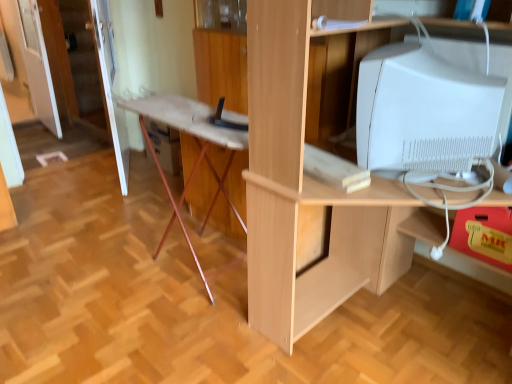
The image size is (512, 384). What do you see at coordinates (311, 186) in the screenshot?
I see `light wood desk at center` at bounding box center [311, 186].

Describe the element at coordinates (83, 72) in the screenshot. The height and width of the screenshot is (384, 512). I see `white glossy door at upper left, the 1th door positioned from the left` at that location.

The height and width of the screenshot is (384, 512). What do you see at coordinates (424, 111) in the screenshot?
I see `white glossy computer monitor at upper right` at bounding box center [424, 111].

You are a GUI agent. You are given a task and a screenshot of the screen. Output one action in this format:
    pyautogui.click(x=<x>, y=<y>)
    Task: Click on the wooden ironing board at center
    
    Given the screenshot: What is the action you would take?
    pyautogui.click(x=197, y=143)

Does point (508, 230) lie behind point (284, 20)?

Yes, point (508, 230) is behind point (284, 20).

Considering the relative sizes of yellow matte drawer at lower right and light wood desk at center in the image provided, is yellow matte drawer at lower right thinner than light wood desk at center?

Indeed, yellow matte drawer at lower right has a lesser width compared to light wood desk at center.

Looking at this image, from a real-world perspective, between yellow matte drawer at lower right and light wood desk at center, who is vertically higher?

From a 3D spatial view, light wood desk at center is above.

Could you tell me if yellow matte drawer at lower right is facing light wood desk at center?

Yes, yellow matte drawer at lower right is turned towards light wood desk at center.

Does white glossy door at upper left, the 1th door positioned from the left, have a smaller size compared to yellow matte drawer at lower right?

No.

Which object is positioned more to the right, white glossy door at upper left, the 1th door positioned from the left, or yellow matte drawer at lower right?

Positioned to the right is yellow matte drawer at lower right.

Is white glossy door at upper left, the 1th door positioned from the left, beside yellow matte drawer at lower right?

No, white glossy door at upper left, the 1th door positioned from the left, is not touching yellow matte drawer at lower right.

From the image's perspective, which is above, white glossy door at upper left, marked as the 2th door in a right-to-left arrangement, or yellow matte drawer at lower right?

white glossy door at upper left, marked as the 2th door in a right-to-left arrangement.

Is wooden ironing board at center to the right of light wood desk at center from the viewer's perspective?

No, wooden ironing board at center is not to the right of light wood desk at center.

Choose the correct answer: Is wooden ironing board at center inside light wood desk at center or outside it?

The correct answer is: outside.

Between wooden ironing board at center and light wood desk at center, which one has less height?

Standing shorter between the two is wooden ironing board at center.

Can you confirm if white glossy door at upper left, which is counted as the first door, starting from the right, is bigger than white glossy computer monitor at upper right?

Correct, white glossy door at upper left, which is counted as the first door, starting from the right, is larger in size than white glossy computer monitor at upper right.

Locate an element on the screen. This screenshot has height=384, width=512. computer monitor below the white glossy door at upper left, which is counted as the first door, starting from the right (from the image's perspective) is located at coordinates (424, 111).

Can white glossy computer monitor at upper right be found inside white glossy door at upper left, the 2th door positioned from the left?

No, white glossy computer monitor at upper right is not a part of white glossy door at upper left, the 2th door positioned from the left.

From a real-world perspective, who is located lower, white glossy door at upper left, the 2th door positioned from the left, or white glossy computer monitor at upper right?

From a 3D spatial view, white glossy door at upper left, the 2th door positioned from the left, is below.

In the image, is transparent glass door at upper left on the left side or the right side of white glossy door at upper left, the 1th door positioned from the left?

From the image, it's evident that transparent glass door at upper left is to the left of white glossy door at upper left, the 1th door positioned from the left.

Considering the relative sizes of transparent glass door at upper left and white glossy door at upper left, marked as the 2th door in a right-to-left arrangement, in the image provided, is transparent glass door at upper left shorter than white glossy door at upper left, marked as the 2th door in a right-to-left arrangement,?

No.

From the image's perspective, which object appears higher, transparent glass door at upper left or white glossy door at upper left, the 1th door positioned from the left?

transparent glass door at upper left.

Is transparent glass door at upper left oriented towards white glossy door at upper left, marked as the 2th door in a right-to-left arrangement?

No, transparent glass door at upper left is not turned towards white glossy door at upper left, marked as the 2th door in a right-to-left arrangement.

Can you confirm if white glossy door at upper left, marked as the 2th door in a right-to-left arrangement, is smaller than light wood desk at center?

Yes.

Is point (103, 13) closer or farther from the camera than point (418, 216)?

Clearly, point (103, 13) is more distant from the camera than point (418, 216).

How many degrees apart are the facing directions of white glossy door at upper left, marked as the 2th door in a right-to-left arrangement, and light wood desk at center?

The angular difference between white glossy door at upper left, marked as the 2th door in a right-to-left arrangement, and light wood desk at center is 88.3 degrees.

Based on the photo, from a real-world perspective, between white glossy door at upper left, the 1th door positioned from the left, and light wood desk at center, who is vertically lower?

white glossy door at upper left, the 1th door positioned from the left, from a real-world perspective.

Between light wood desk at center and white glossy door at upper left, the 2th door positioned from the left, which one is positioned behind?

white glossy door at upper left, the 2th door positioned from the left.

Is light wood desk at center aimed at white glossy door at upper left, which is counted as the first door, starting from the right?

No, light wood desk at center is not aimed at white glossy door at upper left, which is counted as the first door, starting from the right.

Between light wood desk at center and white glossy door at upper left, the 2th door positioned from the left, which one has larger size?

light wood desk at center is bigger.

Is light wood desk at center beside white glossy door at upper left, the 2th door positioned from the left?

No.

Image resolution: width=512 pixels, height=384 pixels. Find the location of `drawer below the light wood desk at center (from a real-world perspective)`. drawer below the light wood desk at center (from a real-world perspective) is located at coordinates (484, 235).

There is a yellow matte drawer at lower right. Where is `the 2nd door above it (from the image's perspective)`? the 2nd door above it (from the image's perspective) is located at coordinates (83, 72).

Which object lies nearer to the anchor point white glossy computer monitor at upper right, light wood desk at center or yellow matte drawer at lower right?

light wood desk at center lies closer to white glossy computer monitor at upper right than the other object.

Considering their positions, is yellow matte drawer at lower right positioned closer to white glossy door at upper left, marked as the 2th door in a right-to-left arrangement, than light wood desk at center?

light wood desk at center lies closer to white glossy door at upper left, marked as the 2th door in a right-to-left arrangement, than the other object.

Consider the image. When comparing their distances from white glossy door at upper left, the 2th door positioned from the left, does transparent glass door at upper left or wooden ironing board at center seem further?

Among the two, transparent glass door at upper left is located further to white glossy door at upper left, the 2th door positioned from the left.

Based on their spatial positions, is light wood desk at center or yellow matte drawer at lower right closer to transparent glass door at upper left?

light wood desk at center is closer to transparent glass door at upper left.

Which object lies nearer to the anchor point white glossy door at upper left, marked as the 2th door in a right-to-left arrangement, wooden ironing board at center or light wood desk at center?

wooden ironing board at center lies closer to white glossy door at upper left, marked as the 2th door in a right-to-left arrangement, than the other object.

From the image, which object appears to be farther from light wood desk at center, white glossy computer monitor at upper right or white glossy door at upper left, marked as the 2th door in a right-to-left arrangement?

white glossy door at upper left, marked as the 2th door in a right-to-left arrangement, is further to light wood desk at center.

Estimate the real-world distances between objects in this image. Which object is further from white glossy computer monitor at upper right, white glossy door at upper left, marked as the 2th door in a right-to-left arrangement, or transparent glass door at upper left?

→ transparent glass door at upper left.

Based on their spatial positions, is yellow matte drawer at lower right or transparent glass door at upper left further from white glossy door at upper left, the 1th door positioned from the left?

yellow matte drawer at lower right is further to white glossy door at upper left, the 1th door positioned from the left.

This screenshot has height=384, width=512. Identify the location of computer desk located between white glossy door at upper left, marked as the 2th door in a right-to-left arrangement, and white glossy computer monitor at upper right in the left-right direction. (197, 143).

Locate an element on the screen. This screenshot has height=384, width=512. desk between white glossy door at upper left, the 1th door positioned from the left, and yellow matte drawer at lower right is located at coordinates (311, 186).

At what (x,y) coordinates should I click in order to perform the action: click on desk between transparent glass door at upper left and yellow matte drawer at lower right in the horizontal direction. Please return your answer as a coordinate pair (x, y). Looking at the image, I should click on (311, 186).

At what (x,y) coordinates should I click in order to perform the action: click on computer monitor between wooden ironing board at center and light wood desk at center in the horizontal direction. Please return your answer as a coordinate pair (x, y). This screenshot has height=384, width=512. Looking at the image, I should click on (424, 111).